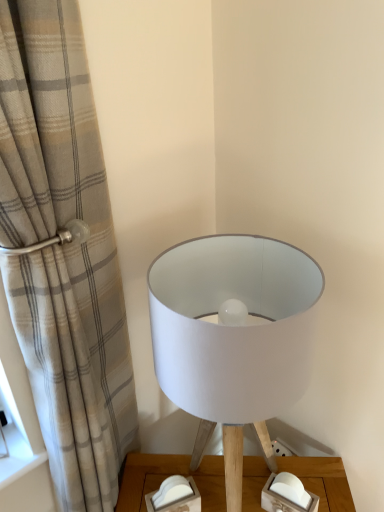
Question: Does beige plaid curtain at left have a smaller size compared to white paper lampshade at center?

Choices:
 (A) no
 (B) yes

Answer: (A)

Question: Considering the relative positions of beige plaid curtain at left and white paper lampshade at center in the image provided, is beige plaid curtain at left behind white paper lampshade at center?

Choices:
 (A) no
 (B) yes

Answer: (A)

Question: Is beige plaid curtain at left wider than white paper lampshade at center?

Choices:
 (A) no
 (B) yes

Answer: (A)

Question: Can you confirm if beige plaid curtain at left is taller than white paper lampshade at center?

Choices:
 (A) yes
 (B) no

Answer: (A)

Question: Considering the relative sizes of beige plaid curtain at left and white paper lampshade at center in the image provided, is beige plaid curtain at left shorter than white paper lampshade at center?

Choices:
 (A) no
 (B) yes

Answer: (A)

Question: Does beige plaid curtain at left have a lesser width compared to white paper lampshade at center?

Choices:
 (A) no
 (B) yes

Answer: (B)

Question: Can you confirm if white paper lampshade at center is smaller than beige plaid curtain at left?

Choices:
 (A) yes
 (B) no

Answer: (A)

Question: Is white paper lampshade at center oriented towards beige plaid curtain at left?

Choices:
 (A) yes
 (B) no

Answer: (B)

Question: Is white paper lampshade at center not inside beige plaid curtain at left?

Choices:
 (A) yes
 (B) no

Answer: (A)

Question: Is white paper lampshade at center behind beige plaid curtain at left?

Choices:
 (A) no
 (B) yes

Answer: (B)

Question: Is white paper lampshade at center next to beige plaid curtain at left and touching it?

Choices:
 (A) no
 (B) yes

Answer: (A)

Question: Is beige plaid curtain at left inside white paper lampshade at center?

Choices:
 (A) no
 (B) yes

Answer: (A)

Question: Which is correct: beige plaid curtain at left is inside white paper lampshade at center, or outside of it?

Choices:
 (A) inside
 (B) outside

Answer: (B)